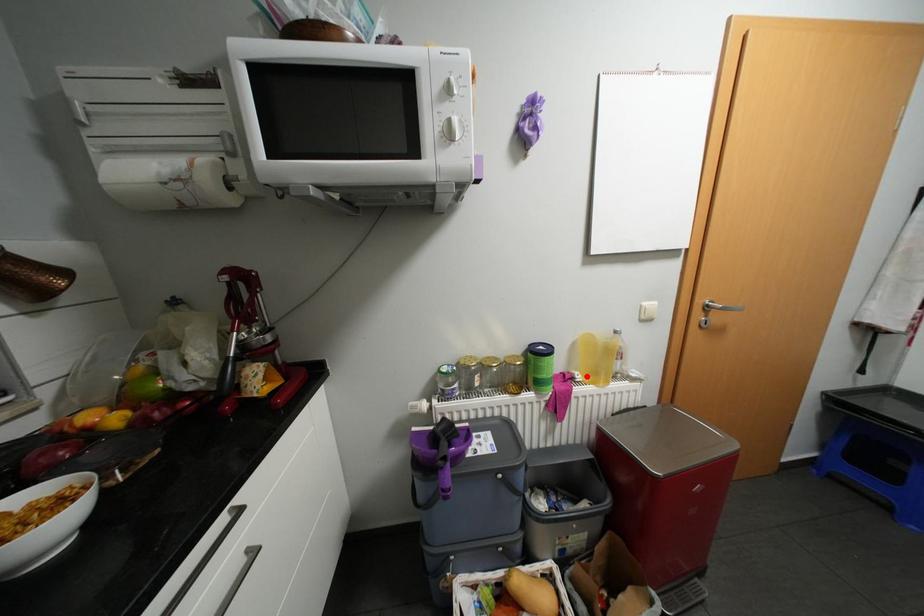
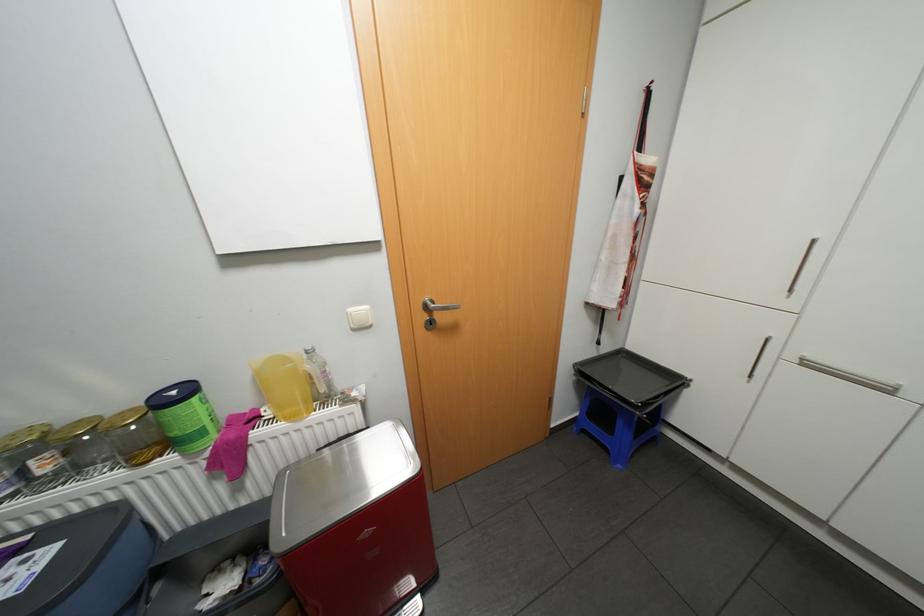
Locate, in the second image, the point that corresponds to the highlighted location in the first image.

(275, 413)